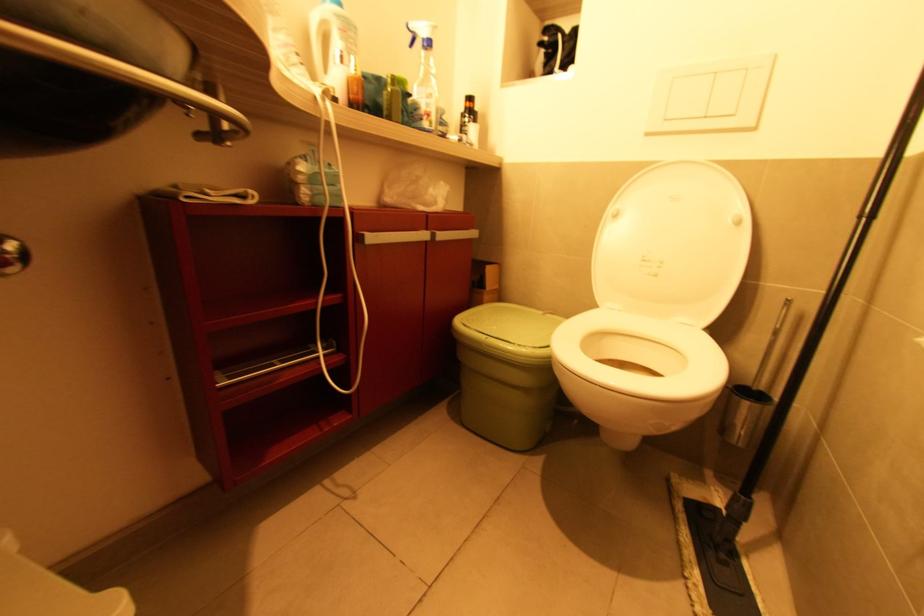
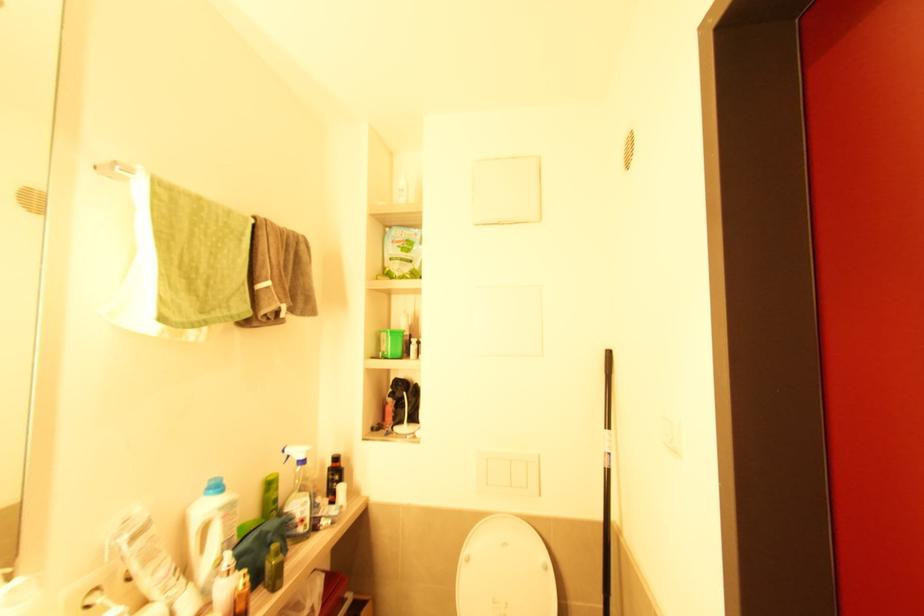
The point at (617, 217) is marked in the first image. Where is the corresponding point in the second image?

(469, 561)